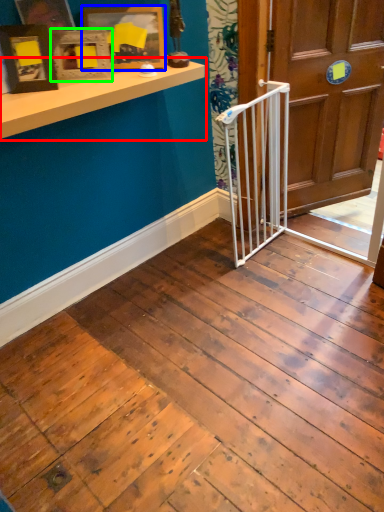
Question: Which is farther away from window sill (highlighted by a red box)? picture frame (highlighted by a blue box) or picture frame (highlighted by a green box)?

Choices:
 (A) picture frame
 (B) picture frame

Answer: (A)